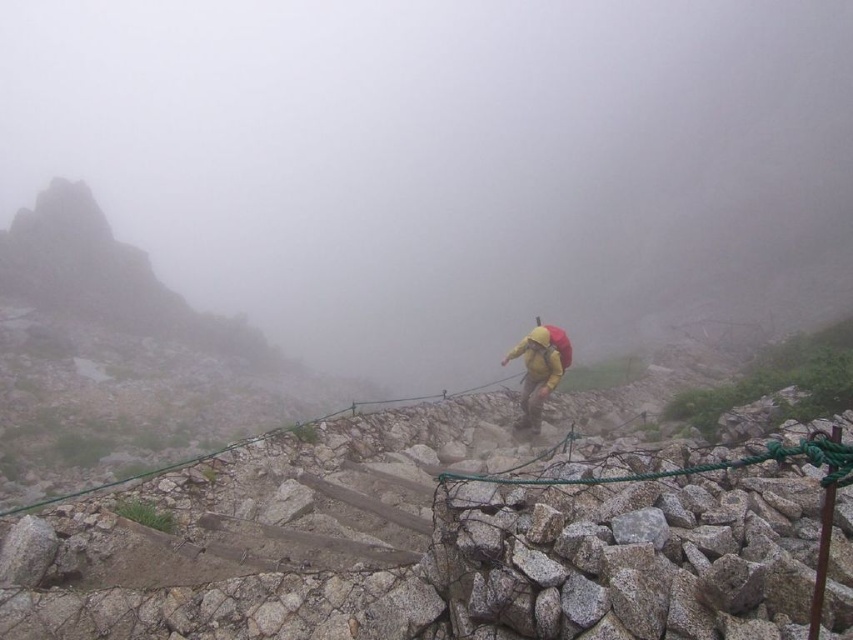
Question: Among these objects, which one is nearest to the camera?

Choices:
 (A) green rope at center
 (B) yellow fabric backpack at center

Answer: (A)

Question: Is green rope at center positioned at the back of yellow fabric backpack at center?

Choices:
 (A) yes
 (B) no

Answer: (B)

Question: Does green rope at center come behind yellow fabric backpack at center?

Choices:
 (A) no
 (B) yes

Answer: (A)

Question: Which of the following is the closest to the observer?

Choices:
 (A) (538, 326)
 (B) (469, 474)

Answer: (B)

Question: Which object is farther from the camera taking this photo?

Choices:
 (A) yellow fabric backpack at center
 (B) green rope at center

Answer: (A)

Question: Does green rope at center appear on the right side of yellow fabric backpack at center?

Choices:
 (A) yes
 (B) no

Answer: (B)